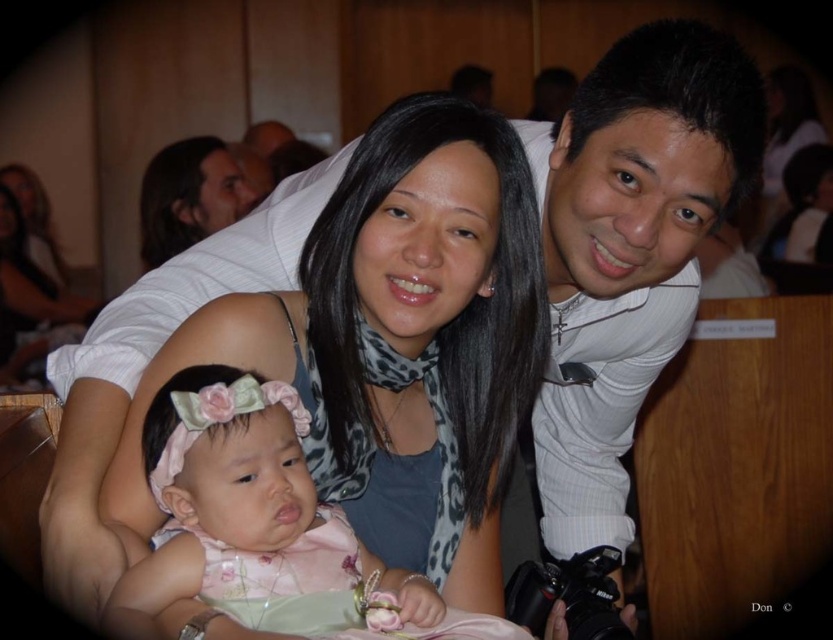
You are a photographer at a family event and need to capture a closeup of the pink satin dress at center and the matte black scarf at upper center. Which object will appear larger in the photo?

The pink satin dress at center will appear larger in the photo because it is closer to the viewer than the matte black scarf at upper center.

You are a photographer at a family event and need to ensure that both the matte gray scarf at center and the pink satin dress at center are visible in your shot. Given their sizes, which object should you focus on to capture both without cropping?

The matte gray scarf at center is wider than the pink satin dress at center. To capture both without cropping, focus on the wider matte gray scarf at center as it requires more space in the frame.

You are a photographer at a family event and need to adjust the lighting to ensure both the pink satin dress at center and the matte black scarf at upper center are visible. Which object might require more light due to its material properties?

The matte black scarf at upper center might require more light because matte materials absorb more light and appear darker compared to the shiny pink satin dress at center, which reflects light better.